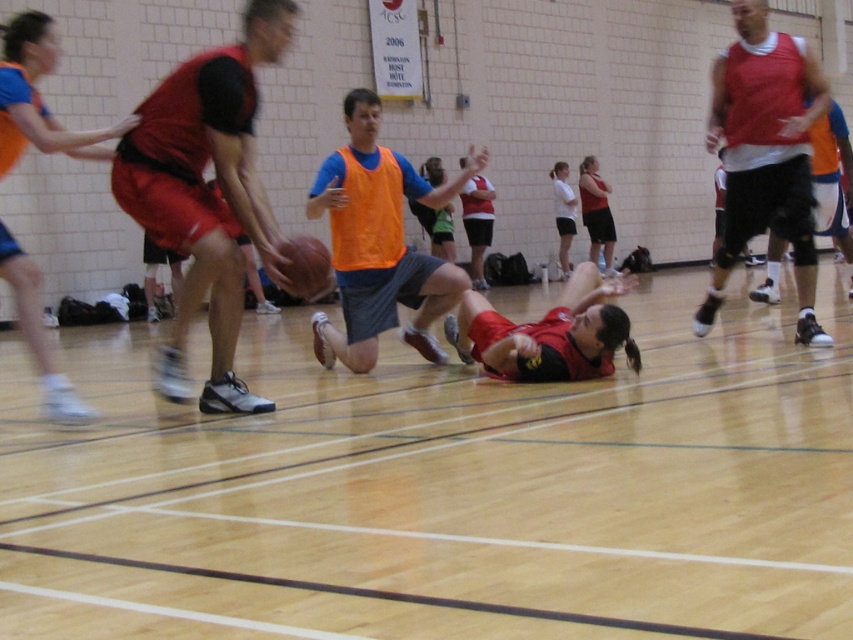
You are a spectator at the basketball game. You notice a point marked at coordinates (552, 332). What object is this point located on?

The point at coordinates (552, 332) is located on the matte red shorts at center.

You are a spectator sitting at the back of the gymnasium watching the basketball game. You notice the wooden floor at center and the matte black shorts at left. Which object is closer to you?

The wooden floor at center is closer to you because it is in front of the matte black shorts at left.

You are a basketball coach observing the game. You notice the wooden floor at center and the matte black shorts at left. Which object is wider?

The wooden floor at center is wider than the matte black shorts at left.